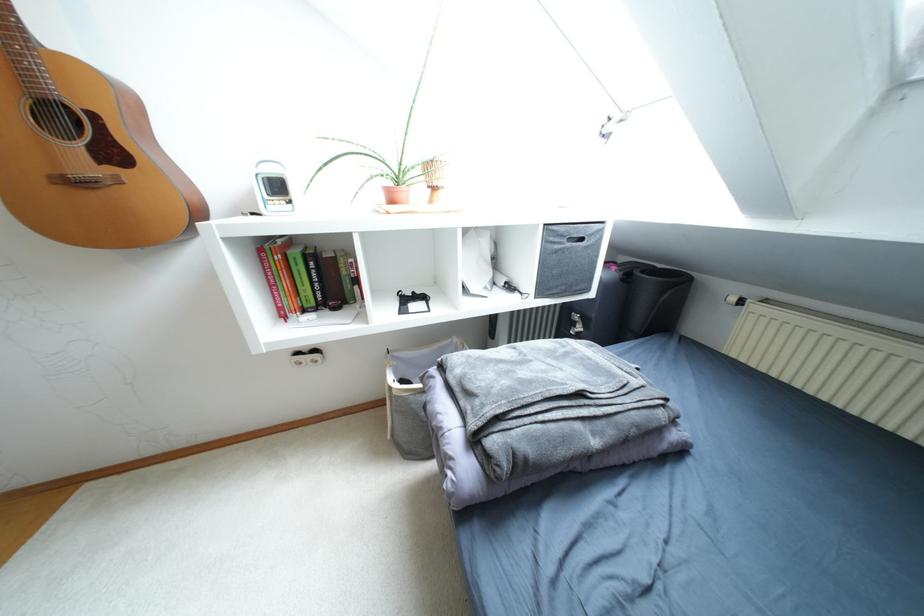
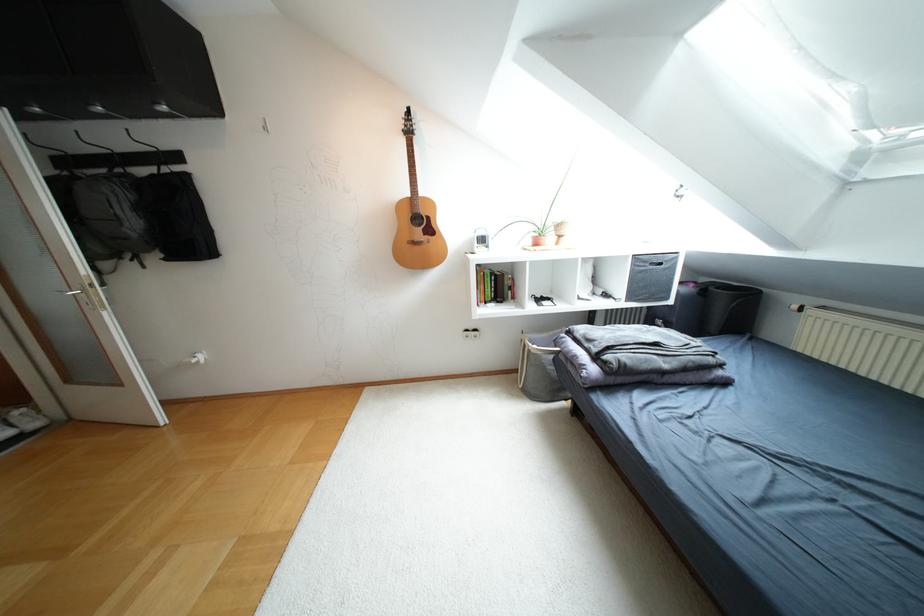
The point at (636, 272) is marked in the first image. Where is the corresponding point in the second image?

(711, 286)